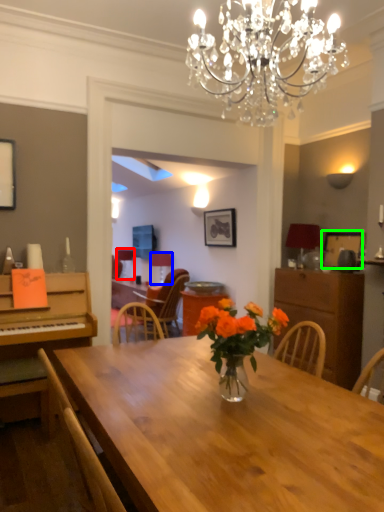
Question: Estimate the real-world distances between objects in this image. Which object is closer to lamp (highlighted by a red box), lamp (highlighted by a blue box) or picture frame (highlighted by a green box)?

Choices:
 (A) lamp
 (B) picture frame

Answer: (A)